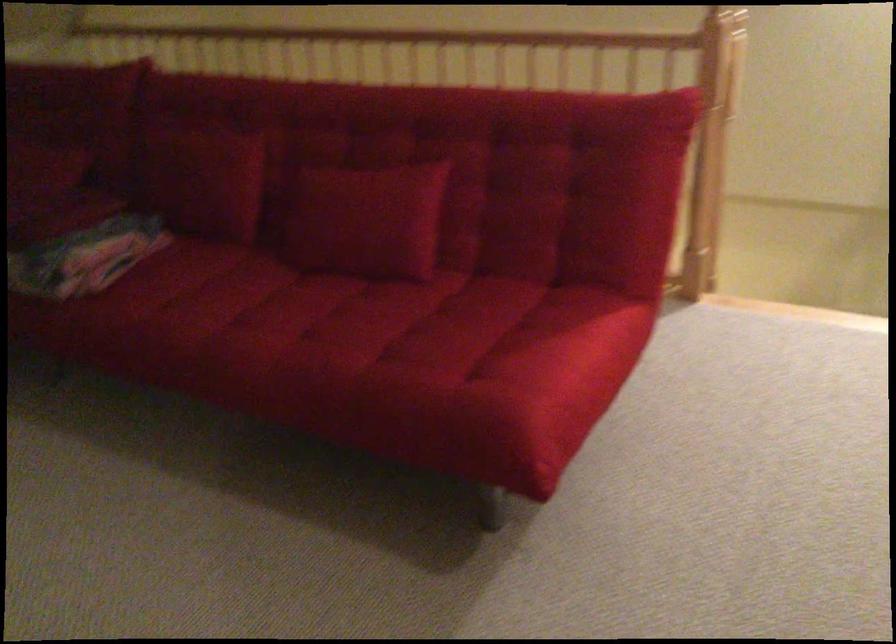
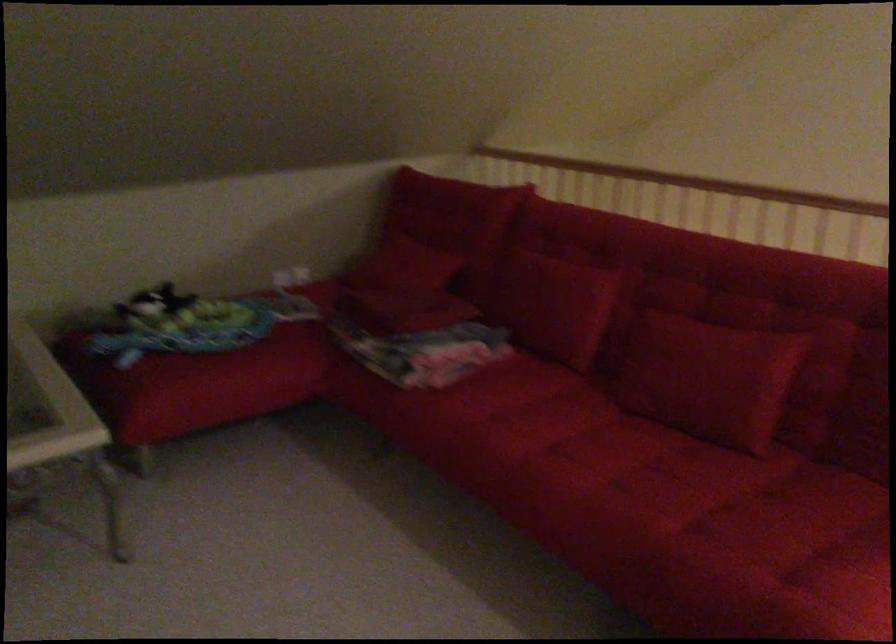
Locate, in the second image, the point that corresponds to point 208,192 in the first image.

(555, 306)